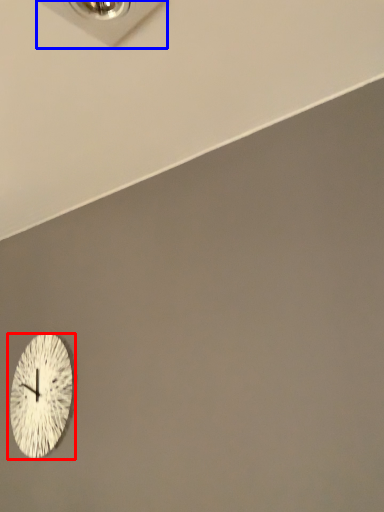
Question: Among these objects, which one is nearest to the camera, wall clock (highlighted by a red box) or electric outlet (highlighted by a blue box)?

Choices:
 (A) wall clock
 (B) electric outlet

Answer: (B)